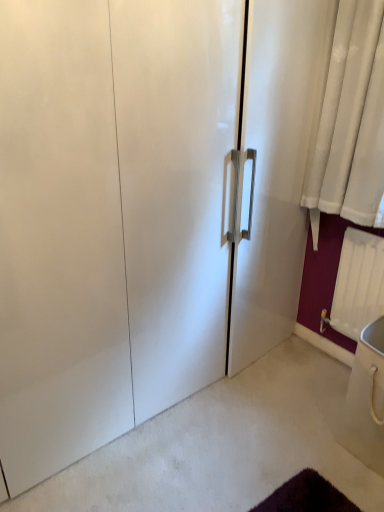
At what (x,y) coordinates should I click in order to perform the action: click on white plastic radiator at lower right. Please return your answer as a coordinate pair (x, y). The width and height of the screenshot is (384, 512). Looking at the image, I should click on (358, 283).

Measure the distance between point (357, 263) and camera.

They are 6.17 feet apart.

What do you see at coordinates (358, 283) in the screenshot? The image size is (384, 512). I see `white plastic radiator at lower right` at bounding box center [358, 283].

What do you see at coordinates (366, 400) in the screenshot? Image resolution: width=384 pixels, height=512 pixels. I see `white glossy sink at lower right` at bounding box center [366, 400].

Where is `white glossy sink at lower right`? This screenshot has height=512, width=384. white glossy sink at lower right is located at coordinates (366, 400).

Find the location of a particular element. The width and height of the screenshot is (384, 512). white plastic radiator at lower right is located at coordinates (358, 283).

Considering the positions of objects white plastic radiator at lower right and white glossy sink at lower right in the image provided, who is more to the right, white plastic radiator at lower right or white glossy sink at lower right?

From the viewer's perspective, white glossy sink at lower right appears more on the right side.

Is the position of white plastic radiator at lower right more distant than that of white glossy sink at lower right?

Yes, white plastic radiator at lower right is further from the camera.

Does point (343, 240) come in front of point (381, 387)?

No, (343, 240) is further to viewer.

From the image's perspective, is white plastic radiator at lower right above white glossy sink at lower right?

Yes, from the image's perspective, white plastic radiator at lower right is over white glossy sink at lower right.

From a real-world perspective, which object stands above the other?

white plastic radiator at lower right, from a real-world perspective.

Looking at their sizes, would you say white plastic radiator at lower right is wider or thinner than white glossy sink at lower right?

white plastic radiator at lower right is thinner than white glossy sink at lower right.

Between white plastic radiator at lower right and white glossy sink at lower right, which one has more height?

With more height is white plastic radiator at lower right.

Who is smaller, white plastic radiator at lower right or white glossy sink at lower right?

Smaller between the two is white plastic radiator at lower right.

Is white glossy sink at lower right surrounded by white plastic radiator at lower right?

Definitely not — white glossy sink at lower right is not inside white plastic radiator at lower right.

Is white plastic radiator at lower right not near white glossy sink at lower right?

No, white plastic radiator at lower right is not far away from white glossy sink at lower right.

Is white plastic radiator at lower right looking in the opposite direction of white glossy sink at lower right?

white plastic radiator at lower right is not turned away from white glossy sink at lower right.

How many degrees apart are the facing directions of white plastic radiator at lower right and white glossy sink at lower right?

0.891 degrees separate the facing orientations of white plastic radiator at lower right and white glossy sink at lower right.

Locate an element on the screen. radiator located on the left of white glossy sink at lower right is located at coordinates (358, 283).

Is white glossy sink at lower right at the left side of white plastic radiator at lower right?

In fact, white glossy sink at lower right is to the right of white plastic radiator at lower right.

Considering the positions of objects white glossy sink at lower right and white plastic radiator at lower right in the image provided, who is in front, white glossy sink at lower right or white plastic radiator at lower right?

white glossy sink at lower right.

Is point (364, 424) closer or farther from the camera than point (344, 269)?

Point (364, 424) is closer to the camera than point (344, 269).

From the image's perspective, which one is positioned lower, white glossy sink at lower right or white plastic radiator at lower right?

white glossy sink at lower right is shown below in the image.

From a real-world perspective, is white glossy sink at lower right physically below white plastic radiator at lower right?

Yes, from a real-world perspective, white glossy sink at lower right is beneath white plastic radiator at lower right.

Can you confirm if white glossy sink at lower right is thinner than white plastic radiator at lower right?

No.

Considering the relative sizes of white glossy sink at lower right and white plastic radiator at lower right in the image provided, is white glossy sink at lower right taller than white plastic radiator at lower right?

Incorrect, the height of white glossy sink at lower right is not larger of that of white plastic radiator at lower right.

Considering the relative sizes of white glossy sink at lower right and white plastic radiator at lower right in the image provided, is white glossy sink at lower right bigger than white plastic radiator at lower right?

Yes.

Would you say white glossy sink at lower right is inside or outside white plastic radiator at lower right?

white glossy sink at lower right is not enclosed by white plastic radiator at lower right.

Is white glossy sink at lower right with white plastic radiator at lower right?

There is a gap between white glossy sink at lower right and white plastic radiator at lower right.

Does white glossy sink at lower right turn towards white plastic radiator at lower right?

No, white glossy sink at lower right is not turned towards white plastic radiator at lower right.

How many degrees apart are the facing directions of white glossy sink at lower right and white plastic radiator at lower right?

white glossy sink at lower right and white plastic radiator at lower right are facing 0.891 degrees away from each other.

Where is `sink that appears in front of the white plastic radiator at lower right`? The height and width of the screenshot is (512, 384). sink that appears in front of the white plastic radiator at lower right is located at coordinates (366, 400).

In the image, there is a white glossy sink at lower right. Where is `radiator above it (from the image's perspective)`? The width and height of the screenshot is (384, 512). radiator above it (from the image's perspective) is located at coordinates (358, 283).

The image size is (384, 512). In order to click on sink lying on the right of white plastic radiator at lower right in this screenshot , I will do `click(366, 400)`.